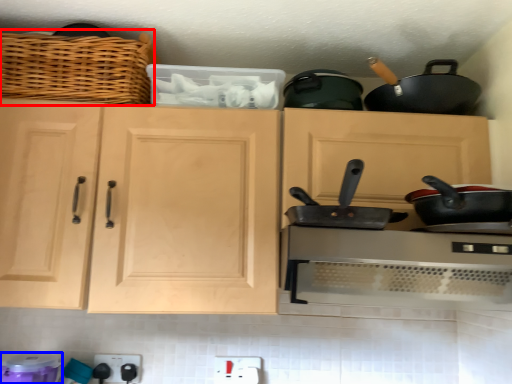
Question: Among these objects, which one is nearest to the camera, basket (highlighted by a red box) or appliance (highlighted by a blue box)?

Choices:
 (A) basket
 (B) appliance

Answer: (B)